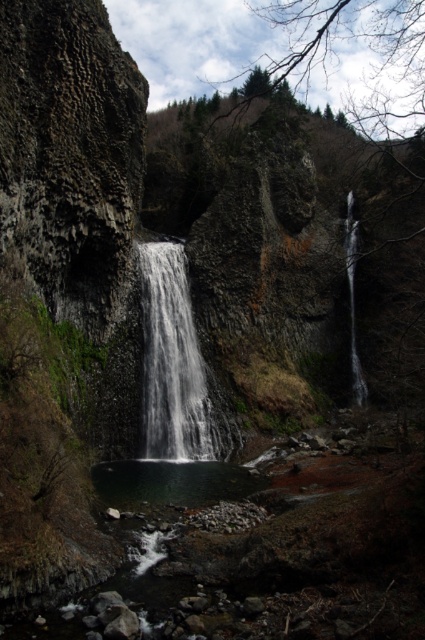
Question: Does white textured waterfall at center come behind clear water at center?

Choices:
 (A) yes
 (B) no

Answer: (B)

Question: Can you confirm if white textured waterfall at center is wider than clear water at center?

Choices:
 (A) no
 (B) yes

Answer: (B)

Question: Which point is closer to the camera taking this photo?

Choices:
 (A) (217, 456)
 (B) (348, 244)

Answer: (A)

Question: Which of the following is the closest to the observer?

Choices:
 (A) white textured waterfall at center
 (B) clear water at center

Answer: (A)

Question: Does white textured waterfall at center appear under clear water at center?

Choices:
 (A) no
 (B) yes

Answer: (B)